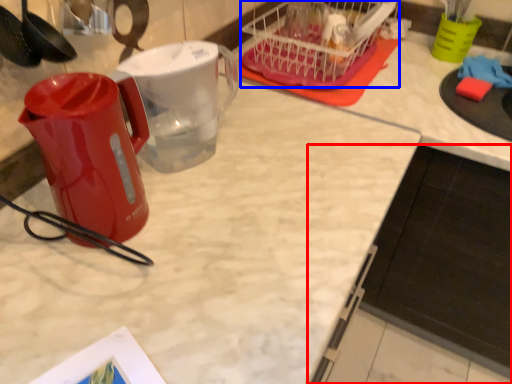
Question: Which of the following is the closest to the observer, cabinetry (highlighted by a red box) or basket (highlighted by a blue box)?

Choices:
 (A) cabinetry
 (B) basket

Answer: (A)